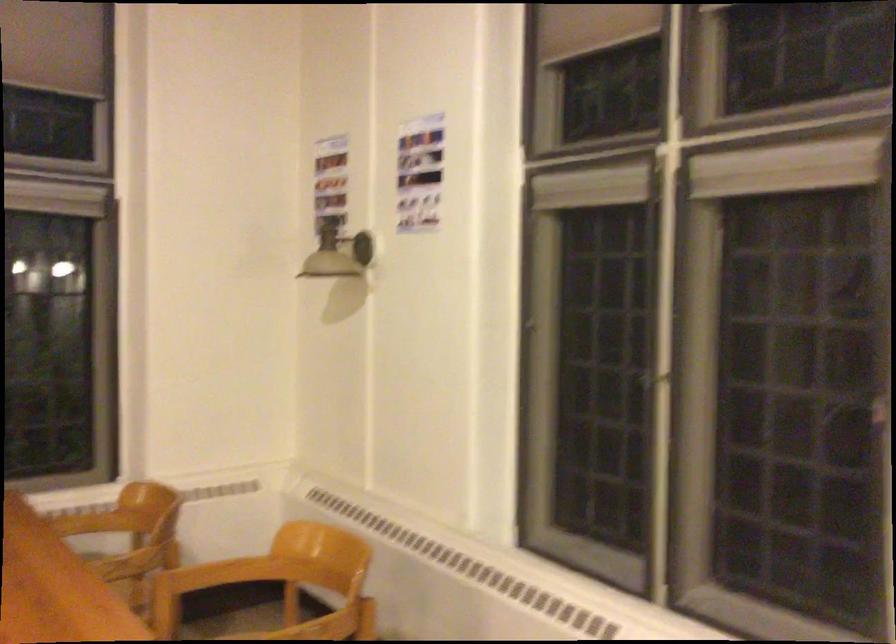
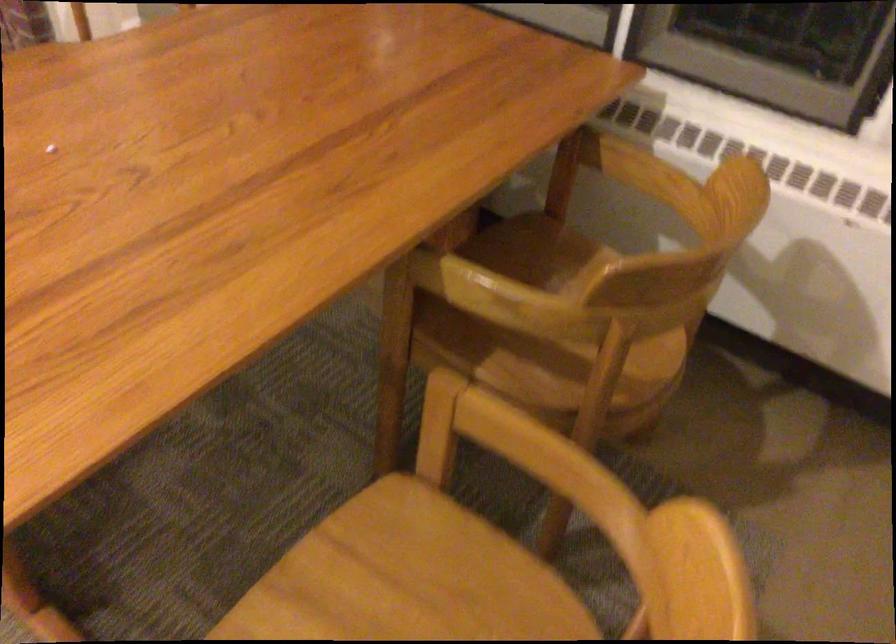
Locate, in the second image, the point that corresponds to (x=128, y=574) in the first image.

(545, 330)